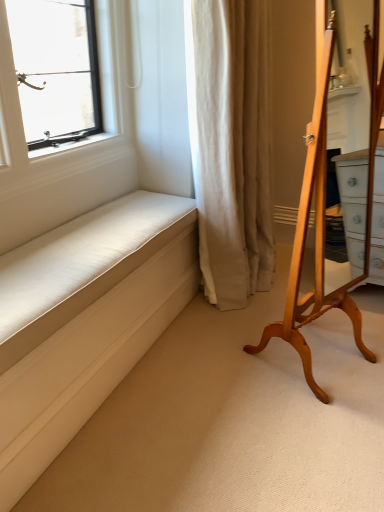
Question: Considering the relative sizes of beige fabric curtain at center and light brown wooden mirror at right in the image provided, is beige fabric curtain at center bigger than light brown wooden mirror at right?

Choices:
 (A) yes
 (B) no

Answer: (A)

Question: Considering the relative sizes of beige fabric curtain at center and light brown wooden mirror at right in the image provided, is beige fabric curtain at center wider than light brown wooden mirror at right?

Choices:
 (A) no
 (B) yes

Answer: (B)

Question: Is beige fabric curtain at center thinner than light brown wooden mirror at right?

Choices:
 (A) yes
 (B) no

Answer: (B)

Question: Is beige fabric curtain at center behind light brown wooden mirror at right?

Choices:
 (A) yes
 (B) no

Answer: (A)

Question: Is light brown wooden mirror at right at the back of beige fabric curtain at center?

Choices:
 (A) yes
 (B) no

Answer: (B)

Question: In terms of width, does light brown wooden mirror at right look wider or thinner when compared to white fabric cushion at lower left?

Choices:
 (A) wide
 (B) thin

Answer: (A)

Question: From the image's perspective, is light brown wooden mirror at right located above or below white fabric cushion at lower left?

Choices:
 (A) above
 (B) below

Answer: (A)

Question: Considering the positions of light brown wooden mirror at right and white fabric cushion at lower left in the image, is light brown wooden mirror at right taller or shorter than white fabric cushion at lower left?

Choices:
 (A) short
 (B) tall

Answer: (B)

Question: Based on their positions, is light brown wooden mirror at right located to the left or right of white fabric cushion at lower left?

Choices:
 (A) right
 (B) left

Answer: (A)

Question: In the image, is white fabric cushion at lower left positioned in front of or behind beige fabric curtain at center?

Choices:
 (A) behind
 (B) front

Answer: (B)

Question: From a real-world perspective, is white fabric cushion at lower left physically located above or below beige fabric curtain at center?

Choices:
 (A) above
 (B) below

Answer: (B)

Question: Considering the positions of white fabric cushion at lower left and beige fabric curtain at center in the image, is white fabric cushion at lower left wider or thinner than beige fabric curtain at center?

Choices:
 (A) thin
 (B) wide

Answer: (A)

Question: In terms of height, does white fabric cushion at lower left look taller or shorter compared to beige fabric curtain at center?

Choices:
 (A) tall
 (B) short

Answer: (B)

Question: Is beige fabric curtain at center taller or shorter than light brown wooden mirror at right?

Choices:
 (A) tall
 (B) short

Answer: (A)

Question: Looking at their shapes, would you say beige fabric curtain at center is wider or thinner than light brown wooden mirror at right?

Choices:
 (A) wide
 (B) thin

Answer: (A)